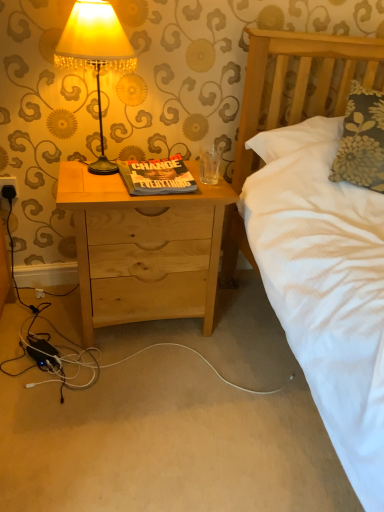
Question: Does matte yellow fabric lampshade at upper left have a lesser height compared to black plastic electric outlet at lower left?

Choices:
 (A) no
 (B) yes

Answer: (A)

Question: Is matte yellow fabric lampshade at upper left completely or partially outside of black plastic electric outlet at lower left?

Choices:
 (A) yes
 (B) no

Answer: (A)

Question: From a real-world perspective, is matte yellow fabric lampshade at upper left beneath black plastic electric outlet at lower left?

Choices:
 (A) yes
 (B) no

Answer: (B)

Question: Can you confirm if matte yellow fabric lampshade at upper left is bigger than black plastic electric outlet at lower left?

Choices:
 (A) yes
 (B) no

Answer: (A)

Question: From the image's perspective, is matte yellow fabric lampshade at upper left located beneath black plastic electric outlet at lower left?

Choices:
 (A) yes
 (B) no

Answer: (B)

Question: Considering the positions of point (112, 26) and point (82, 165), is point (112, 26) closer or farther from the camera than point (82, 165)?

Choices:
 (A) closer
 (B) farther

Answer: (A)

Question: Considering the positions of matte yellow fabric lampshade at upper left and natural wood nightstand at center in the image, is matte yellow fabric lampshade at upper left bigger or smaller than natural wood nightstand at center?

Choices:
 (A) big
 (B) small

Answer: (B)

Question: Which is correct: matte yellow fabric lampshade at upper left is inside natural wood nightstand at center, or outside of it?

Choices:
 (A) inside
 (B) outside

Answer: (B)

Question: From a real-world perspective, is matte yellow fabric lampshade at upper left positioned above or below natural wood nightstand at center?

Choices:
 (A) below
 (B) above

Answer: (B)

Question: In the image, is natural wood nightstand at center positioned in front of or behind matte yellow fabric lampshade at upper left?

Choices:
 (A) behind
 (B) front

Answer: (A)

Question: Is natural wood nightstand at center situated inside matte yellow fabric lampshade at upper left or outside?

Choices:
 (A) outside
 (B) inside

Answer: (A)

Question: From a real-world perspective, is natural wood nightstand at center above or below matte yellow fabric lampshade at upper left?

Choices:
 (A) below
 (B) above

Answer: (A)

Question: Considering the relative positions of natural wood nightstand at center and matte yellow fabric lampshade at upper left in the image provided, is natural wood nightstand at center to the left or to the right of matte yellow fabric lampshade at upper left?

Choices:
 (A) right
 (B) left

Answer: (A)

Question: Is natural wood nightstand at center to the left or to the right of black plastic electric outlet at lower left in the image?

Choices:
 (A) left
 (B) right

Answer: (B)

Question: Do you think natural wood nightstand at center is within black plastic electric outlet at lower left, or outside of it?

Choices:
 (A) outside
 (B) inside

Answer: (A)